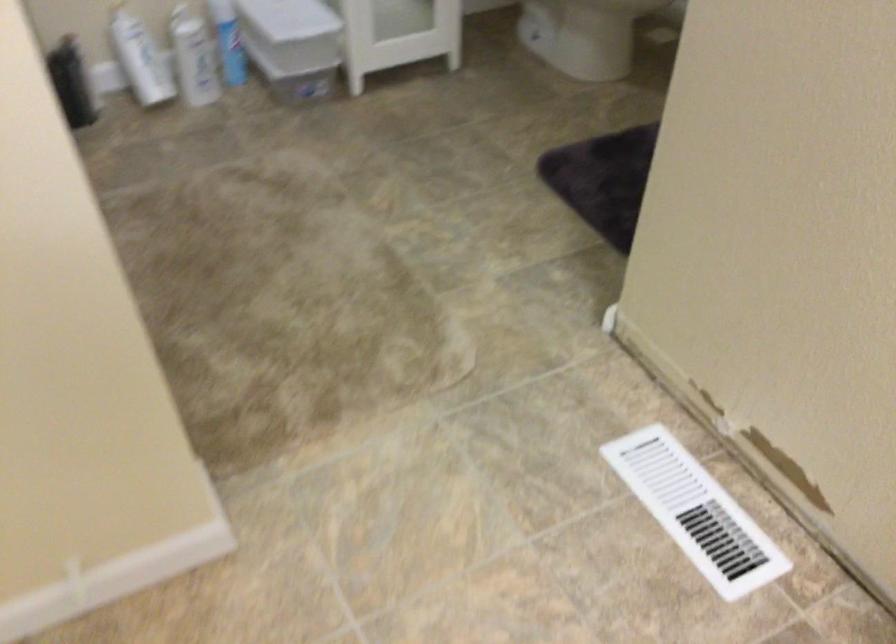
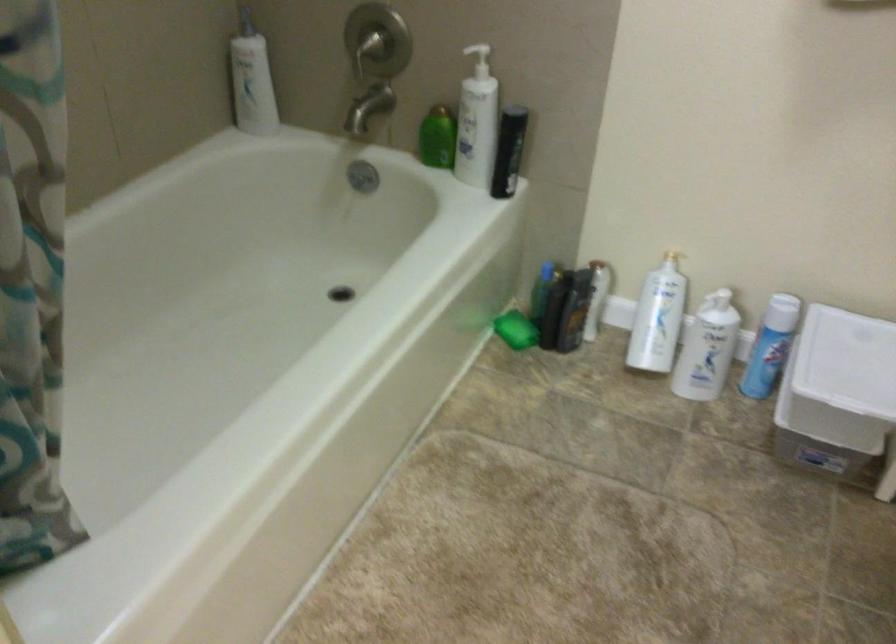
Locate, in the second image, the point that corresponds to (90,76) in the first image.

(574, 310)